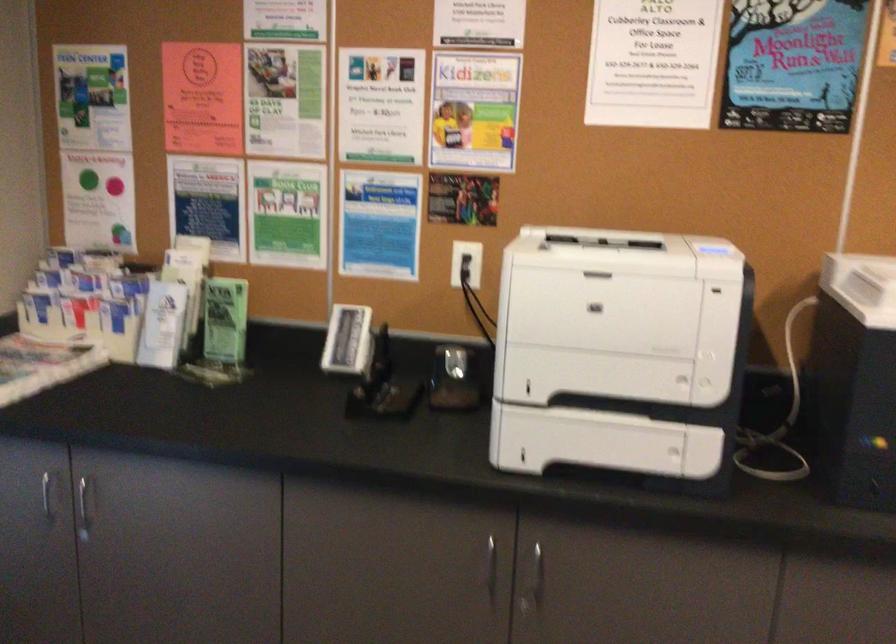
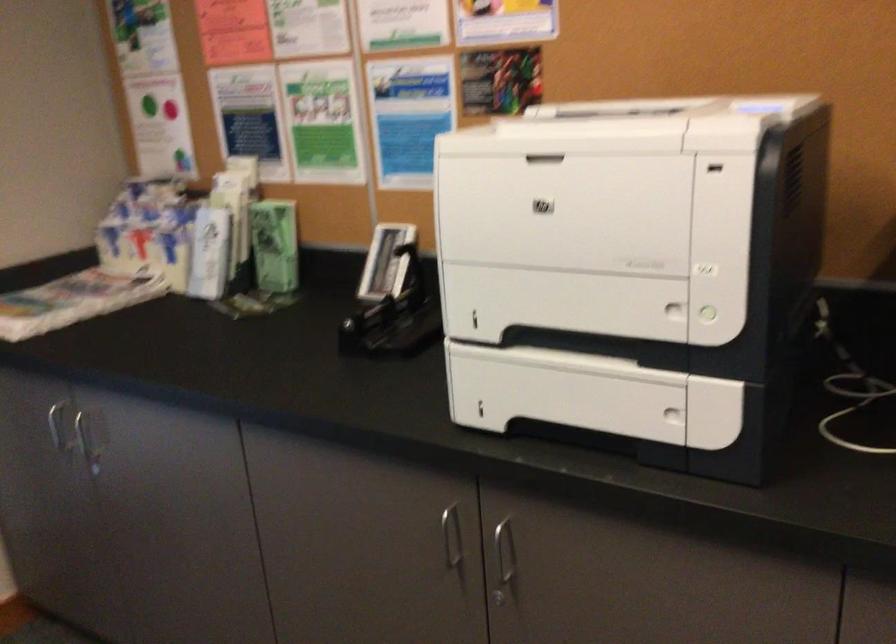
The point at (702, 384) is marked in the first image. Where is the corresponding point in the second image?

(709, 314)